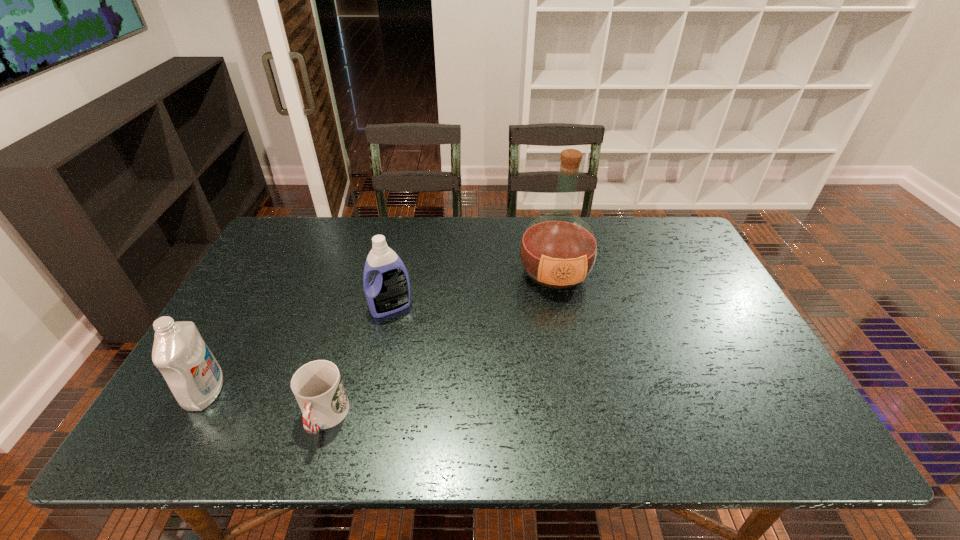
The image size is (960, 540). I want to click on detergent present at the near edge, so click(195, 378).

This screenshot has height=540, width=960. Find the location of `cup present at the near edge`. cup present at the near edge is located at coordinates (318, 388).

I want to click on object at the left edge, so 195,378.

Identify the location of object located in the near left corner section of the desktop. This screenshot has width=960, height=540. (195, 378).

This screenshot has width=960, height=540. In the image, there is a desktop. Identify the location of vacant region at the far edge. (382, 223).

The width and height of the screenshot is (960, 540). Find the location of `free space at the near edge`. free space at the near edge is located at coordinates (231, 448).

Locate an element on the screen. The height and width of the screenshot is (540, 960). vacant region at the left edge of the desktop is located at coordinates (232, 368).

At what (x,y) coordinates should I click in order to perform the action: click on vacant space at the far left corner. Please return your answer as a coordinate pair (x, y). The width and height of the screenshot is (960, 540). Looking at the image, I should click on (291, 254).

The height and width of the screenshot is (540, 960). In the image, there is a desktop. Find the location of `free space at the far right corner`. free space at the far right corner is located at coordinates (672, 235).

You are a GUI agent. You are given a task and a screenshot of the screen. Output one action in this format:
    pyautogui.click(x=<x>, y=<y>)
    Task: Click on the free space between the leftmost object and the liquor
    
    Given the screenshot: What is the action you would take?
    pyautogui.click(x=380, y=333)